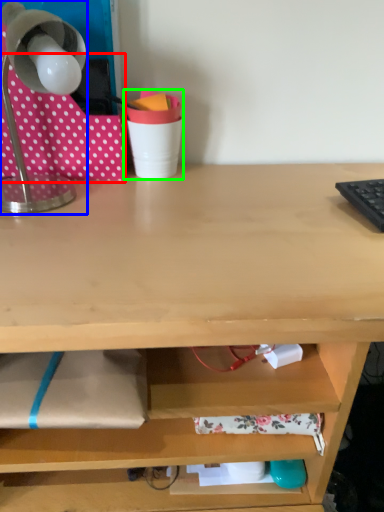
Question: Which object is positioned closest to fabric (highlighted by a red box)? Select from lamp (highlighted by a blue box) and stationery (highlighted by a green box).

Choices:
 (A) lamp
 (B) stationery

Answer: (A)